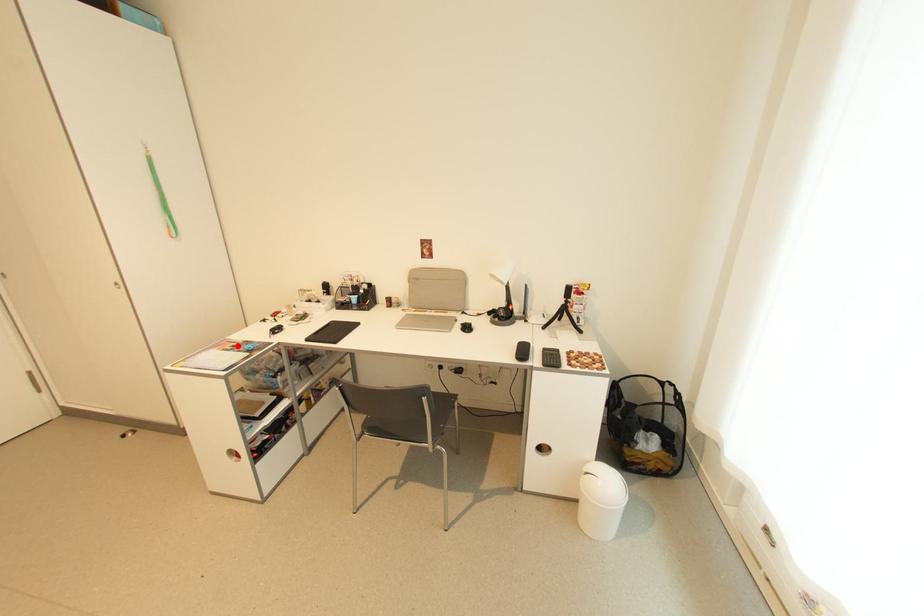
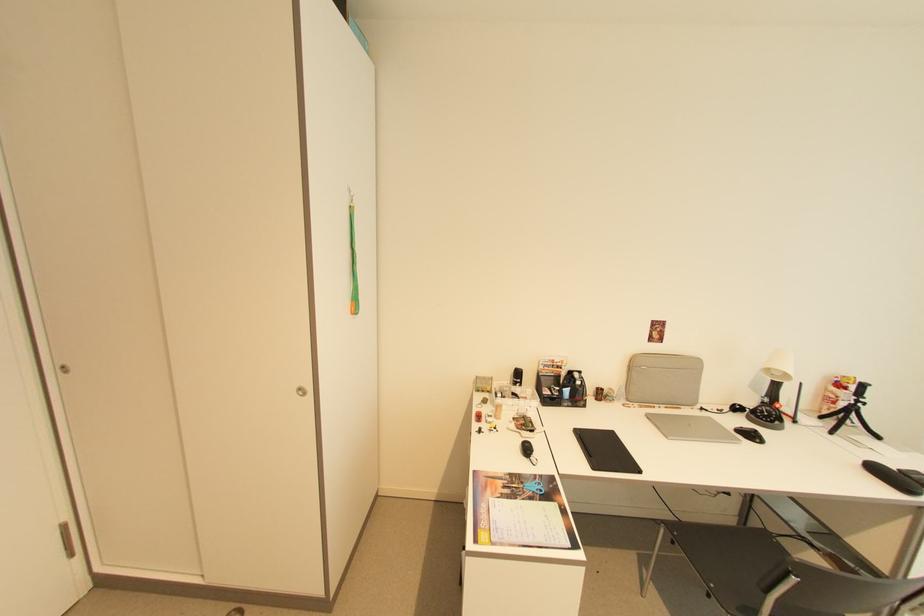
Locate, in the second image, the point that corresponds to the highlighted location in the first image.

(505, 484)